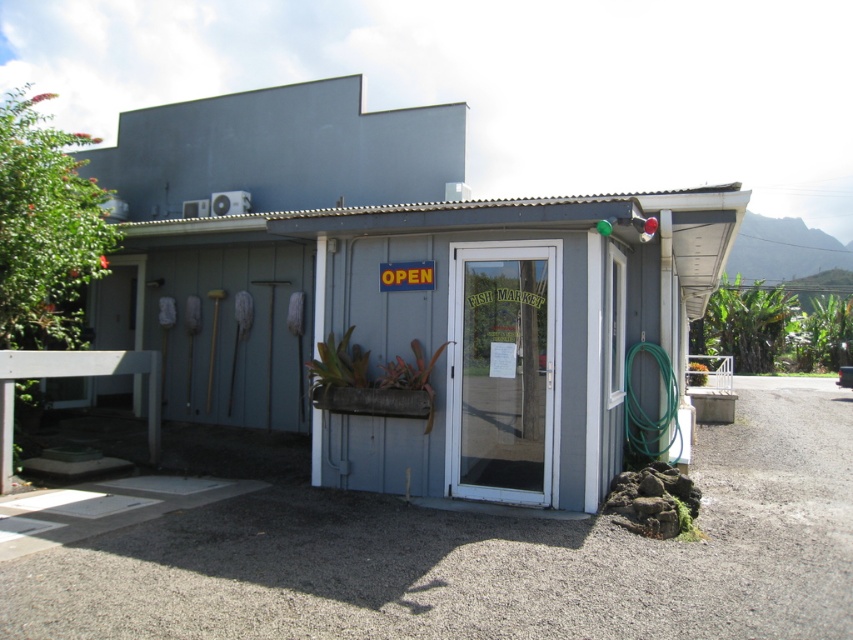
Looking at this image, you are standing at the entrance of the matte gray hut at center. If you walk straight ahead, will you hit the wall immediately?

The position of matte gray hut at center is at point (393, 288), so walking straight ahead from the entrance would not hit the wall immediately as the entrance is likely positioned at the front of the building, allowing space inside.

You are standing at the entrance of the fish market and want to locate two specific points marked on the building. The first point is at coordinate point (503, 316) and the second is at point (546, 241). Which point is closer to you?

Point (503, 316) is closer to you because it is further to the viewer than point (546, 241).

Based on the photo, you are a delivery person trying to park your 2.5 meter wide truck in front of the matte gray hut at center. The green rubber hose at right is coiled against the wall. Considering the space between the hose and the building, can your truck fit without hitting either the hut or the hose?

The matte gray hut at center is wider than the green rubber hose at right, so the truck can fit as long as it stays between them. However, since the exact distance isn